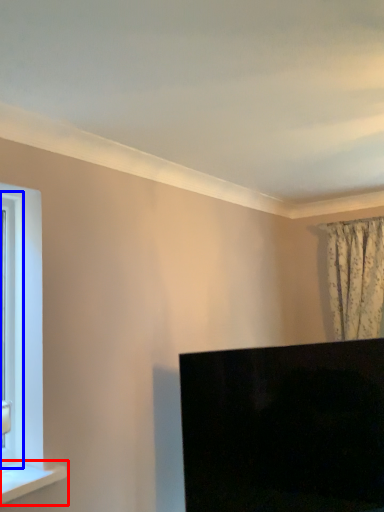
Question: Which object is further to the camera taking this photo, window sill (highlighted by a red box) or window frame (highlighted by a blue box)?

Choices:
 (A) window sill
 (B) window frame

Answer: (B)